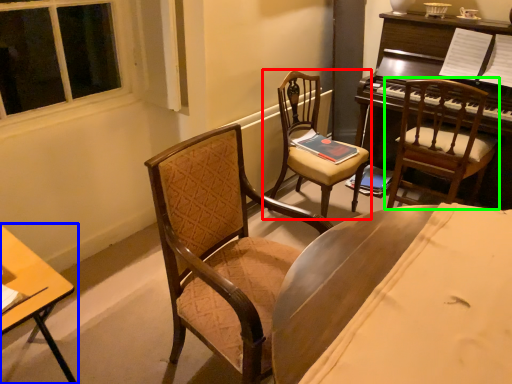
Question: Estimate the real-world distances between objects in this image. Which object is closer to chair (highlighted by a red box), desk (highlighted by a blue box) or chair (highlighted by a green box)?

Choices:
 (A) desk
 (B) chair

Answer: (B)